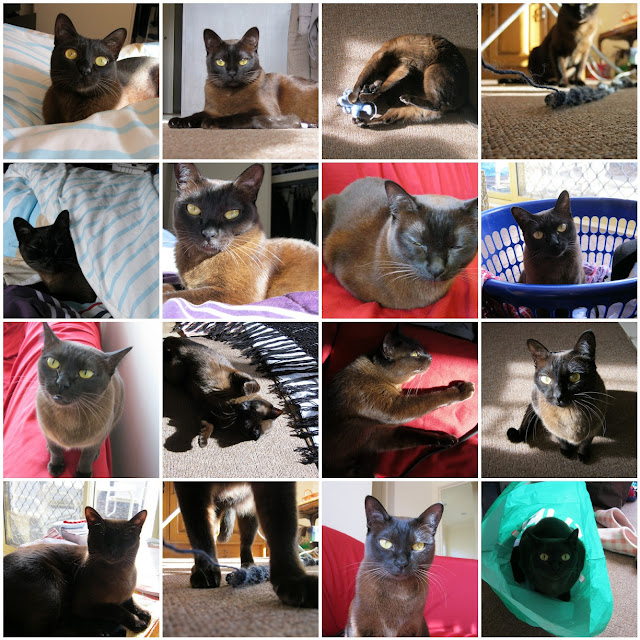
Locate an element on the screen. Image resolution: width=640 pixels, height=640 pixels. floor is located at coordinates (224, 624), (626, 589), (506, 353), (528, 125), (351, 136), (230, 141).